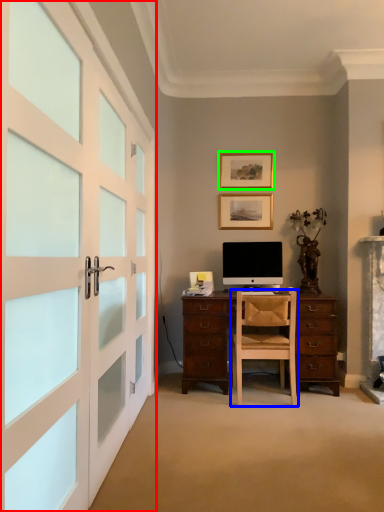
Question: Considering the real-world distances, which object is farthest from garage door (highlighted by a red box)? chair (highlighted by a blue box) or picture frame (highlighted by a green box)?

Choices:
 (A) chair
 (B) picture frame

Answer: (B)